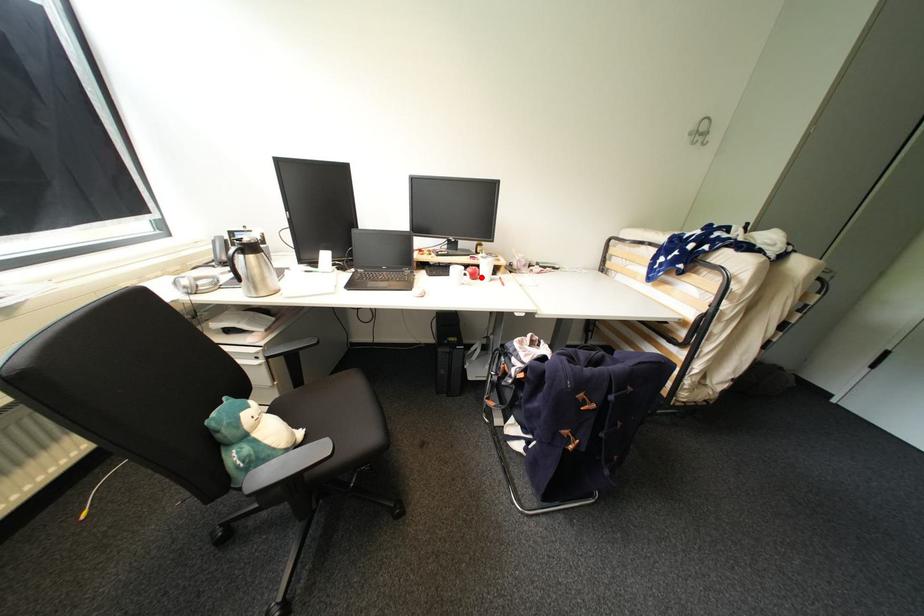
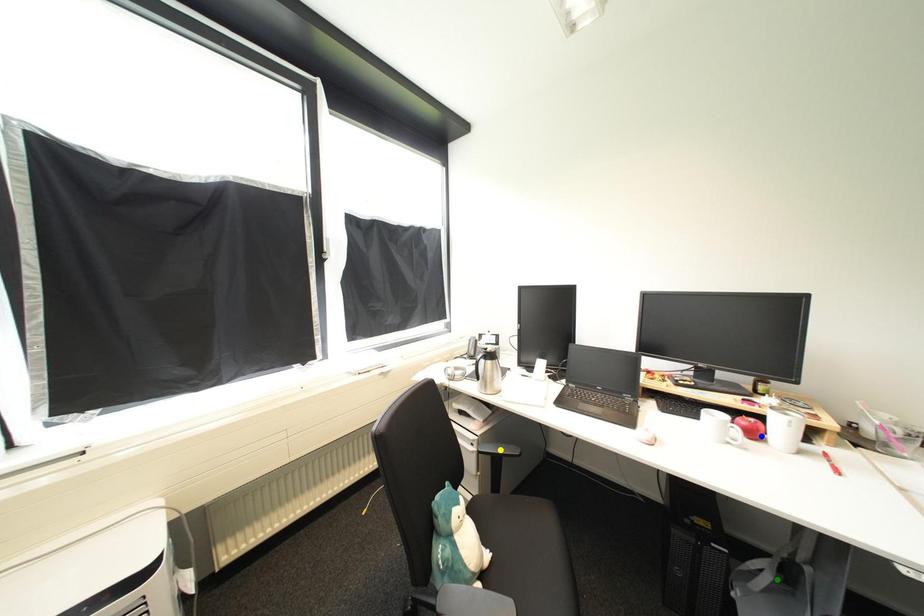
Question: I am providing you with two images of the same scene from different viewpoints. A red point is marked on the first image. You are given multiple points on the second image. Which mark in image 2 goes with the point in image 1?

Choices:
 (A) green point
 (B) blue point
 (C) yellow point

Answer: (B)